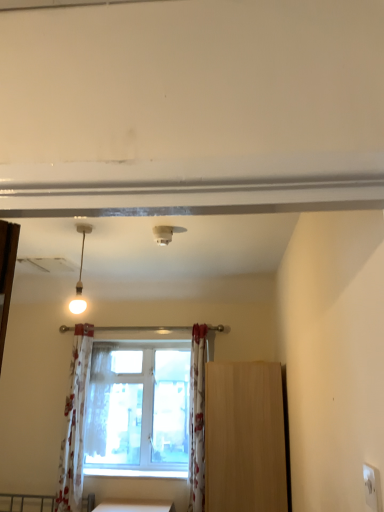
This screenshot has height=512, width=384. Describe the element at coordinates (163, 234) in the screenshot. I see `white plastic smoke detector at upper center` at that location.

Identify the location of white floral fabric curtain at center, the second curtain from the left. This screenshot has height=512, width=384. (197, 420).

Where is `clear glass window at center`? clear glass window at center is located at coordinates (123, 412).

You are a GUI agent. You are given a task and a screenshot of the screen. Output one action in this format:
    pyautogui.click(x=<x>, y=<y>)
    Task: Click on the white floral fabric curtain at left, the second curtain when ordered from right to left
    
    Given the screenshot: What is the action you would take?
    pyautogui.click(x=75, y=423)

The image size is (384, 512). What do you see at coordinates (244, 437) in the screenshot?
I see `light brown wood cabinet at right` at bounding box center [244, 437].

The height and width of the screenshot is (512, 384). In order to click on white plastic smoke detector at upper center in this screenshot , I will do `click(163, 234)`.

Considering the points (204, 326) and (216, 424), which point is behind, point (204, 326) or point (216, 424)?

The point (204, 326) is more distant.

Does white floral fabric curtain at center, the second curtain from the left, appear on the left side of light brown wood cabinet at right?

Correct, you'll find white floral fabric curtain at center, the second curtain from the left, to the left of light brown wood cabinet at right.

Which of these two, white floral fabric curtain at center, the second curtain from the left, or light brown wood cabinet at right, is smaller?

With smaller size is white floral fabric curtain at center, the second curtain from the left.

Considering the sizes of objects white floral fabric curtain at center, the second curtain from the left, and white floral fabric at center in the image provided, who is taller, white floral fabric curtain at center, the second curtain from the left, or white floral fabric at center?

Standing taller between the two is white floral fabric curtain at center, the second curtain from the left.

In the scene shown: Is white floral fabric curtain at center, the second curtain from the left, not close to white floral fabric at center?

Actually, white floral fabric curtain at center, the second curtain from the left, and white floral fabric at center are a little close together.

Looking at this image, could you measure the distance between white floral fabric curtain at center, the second curtain from the left, and white floral fabric at center?

white floral fabric curtain at center, the second curtain from the left, is 30.16 inches away from white floral fabric at center.

Which of these two, white floral fabric curtain at center, acting as the first curtain starting from the right, or white floral fabric at center, is wider?

→ white floral fabric curtain at center, acting as the first curtain starting from the right, is wider.

Is light brown wood cabinet at right taller or shorter than white plastic electric outlet at lower right?

Clearly, light brown wood cabinet at right is taller compared to white plastic electric outlet at lower right.

Is light brown wood cabinet at right facing towards white plastic electric outlet at lower right?

No, light brown wood cabinet at right is not turned towards white plastic electric outlet at lower right.

Is light brown wood cabinet at right in front of or behind white plastic electric outlet at lower right in the image?

In the image, light brown wood cabinet at right appears behind white plastic electric outlet at lower right.

Does light brown wood cabinet at right have a larger size compared to white plastic electric outlet at lower right?

Yes, light brown wood cabinet at right is bigger than white plastic electric outlet at lower right.

Consider the image. Between clear glass window at center and white plastic smoke detector at upper center, which one has more height?

With more height is clear glass window at center.

From the picture: Is clear glass window at center not close to white plastic smoke detector at upper center?

Indeed, clear glass window at center is not near white plastic smoke detector at upper center.

Locate an element on the screen. This screenshot has height=512, width=384. window on the left of white plastic smoke detector at upper center is located at coordinates (123, 412).

Does clear glass window at center turn towards white plastic smoke detector at upper center?

Yes, clear glass window at center faces towards white plastic smoke detector at upper center.

Considering the sizes of objects white floral fabric at center and white plastic smoke detector at upper center in the image provided, who is shorter, white floral fabric at center or white plastic smoke detector at upper center?

Standing shorter between the two is white plastic smoke detector at upper center.

Could you tell me if white floral fabric at center is facing white plastic smoke detector at upper center?

No, white floral fabric at center is not aimed at white plastic smoke detector at upper center.

This screenshot has height=512, width=384. In order to click on lamp lying on the right of white floral fabric at center in this screenshot , I will do `click(163, 234)`.

Is white floral fabric at center touching white plastic smoke detector at upper center?

No, white floral fabric at center is not touching white plastic smoke detector at upper center.

Can you confirm if matte white pendant light at upper left is smaller than white plastic smoke detector at upper center?

No.

Is matte white pendant light at upper left touching white plastic smoke detector at upper center?

No, matte white pendant light at upper left is not in contact with white plastic smoke detector at upper center.

Does matte white pendant light at upper left have a lesser width compared to white plastic smoke detector at upper center?

Yes, matte white pendant light at upper left is thinner than white plastic smoke detector at upper center.

From a real-world perspective, is matte white pendant light at upper left on top of white plastic smoke detector at upper center?

No, from a real-world perspective, matte white pendant light at upper left is not over white plastic smoke detector at upper center

Does white plastic electric outlet at lower right have a lesser height compared to light brown wood cabinet at right?

Correct, white plastic electric outlet at lower right is not as tall as light brown wood cabinet at right.

Can you confirm if white plastic electric outlet at lower right is positioned to the right of light brown wood cabinet at right?

Yes, white plastic electric outlet at lower right is to the right of light brown wood cabinet at right.

Based on the photo, from a real-world perspective, which is physically below, white plastic electric outlet at lower right or light brown wood cabinet at right?

light brown wood cabinet at right is physically lower.

Considering the positions of point (365, 474) and point (265, 432), is point (365, 474) closer or farther from the camera than point (265, 432)?

Point (365, 474) is closer to the camera than point (265, 432).

Where is `furniture in front of the white floral fabric curtain at center, acting as the first curtain starting from the right`? furniture in front of the white floral fabric curtain at center, acting as the first curtain starting from the right is located at coordinates (244, 437).

The image size is (384, 512). What are the coordinates of `curtain located above the white floral fabric at center (from the image's perspective)` in the screenshot? It's located at 197,420.

Looking at this image, estimate the real-world distances between objects in this image. Which object is closer to white floral fabric at center, matte white pendant light at upper left or light brown wood cabinet at right?

The object closer to white floral fabric at center is light brown wood cabinet at right.

Estimate the real-world distances between objects in this image. Which object is closer to white plastic electric outlet at lower right, white floral fabric at center or white floral fabric curtain at center, acting as the first curtain starting from the right?

white floral fabric curtain at center, acting as the first curtain starting from the right, is positioned closer to the anchor white plastic electric outlet at lower right.

Based on their spatial positions, is white floral fabric curtain at left, positioned as the 1th curtain in left-to-right order, or white floral fabric curtain at center, acting as the first curtain starting from the right, further from matte white pendant light at upper left?

white floral fabric curtain at center, acting as the first curtain starting from the right, is positioned further to the anchor matte white pendant light at upper left.

Looking at the image, which one is located closer to clear glass window at center, light brown wood cabinet at right or white floral fabric curtain at center, the second curtain from the left?

Based on the image, white floral fabric curtain at center, the second curtain from the left, appears to be nearer to clear glass window at center.

Looking at the image, which one is located further to white plastic smoke detector at upper center, white floral fabric curtain at left, positioned as the 1th curtain in left-to-right order, or white floral fabric curtain at center, acting as the first curtain starting from the right?

white floral fabric curtain at left, positioned as the 1th curtain in left-to-right order, is positioned further to the anchor white plastic smoke detector at upper center.

Which object lies further to the anchor point white plastic smoke detector at upper center, white floral fabric curtain at left, positioned as the 1th curtain in left-to-right order, or clear glass window at center?

white floral fabric curtain at left, positioned as the 1th curtain in left-to-right order, is positioned further to the anchor white plastic smoke detector at upper center.

Estimate the real-world distances between objects in this image. Which object is further from white floral fabric curtain at center, acting as the first curtain starting from the right, white plastic smoke detector at upper center or white plastic electric outlet at lower right?

Among the two, white plastic electric outlet at lower right is located further to white floral fabric curtain at center, acting as the first curtain starting from the right.

Which object lies nearer to the anchor point clear glass window at center, white floral fabric curtain at center, the second curtain from the left, or matte white pendant light at upper left?

white floral fabric curtain at center, the second curtain from the left.

Identify the location of light fixture located between white plastic electric outlet at lower right and light brown wood cabinet at right in the depth direction. (80, 274).

Identify the location of lamp between white plastic electric outlet at lower right and light brown wood cabinet at right along the z-axis. The image size is (384, 512). (163, 234).

Identify the location of light fixture that lies between white plastic smoke detector at upper center and white floral fabric at center from top to bottom. This screenshot has width=384, height=512. (80, 274).

This screenshot has height=512, width=384. In order to click on shower curtain between white plastic smoke detector at upper center and light brown wood cabinet at right in the vertical direction in this screenshot , I will do `click(98, 401)`.